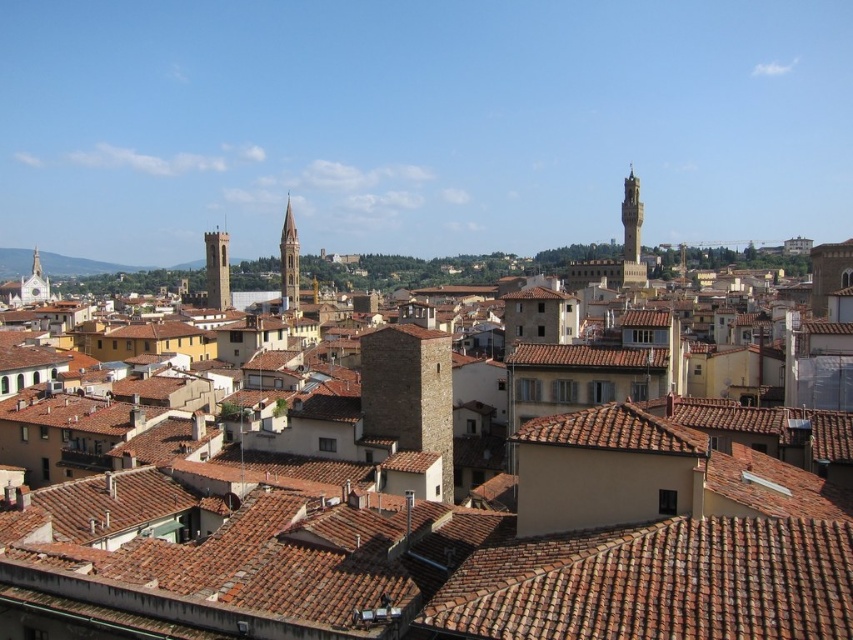
Question: Is brown tile roof at center closer to the viewer compared to golden stone tower at upper right?

Choices:
 (A) yes
 (B) no

Answer: (A)

Question: In this image, where is brown clay roof tiles at center located relative to golden stone tower at upper right?

Choices:
 (A) below
 (B) above

Answer: (A)

Question: Which of the following is the closest to the observer?

Choices:
 (A) white stone tower at left
 (B) smooth beige tower at center
 (C) brown stone tower at center-left

Answer: (B)

Question: Among these points, which one is nearest to the camera?

Choices:
 (A) (554, 365)
 (B) (38, 296)

Answer: (A)

Question: Which of the following is the farthest from the observer?

Choices:
 (A) brown tile roof at center
 (B) brown tile roof at lower right
 (C) white stone tower at left
 (D) brown stone tower at center

Answer: (C)

Question: Is brown clay roof tiles at center to the right of white stone tower at left from the viewer's perspective?

Choices:
 (A) yes
 (B) no

Answer: (A)